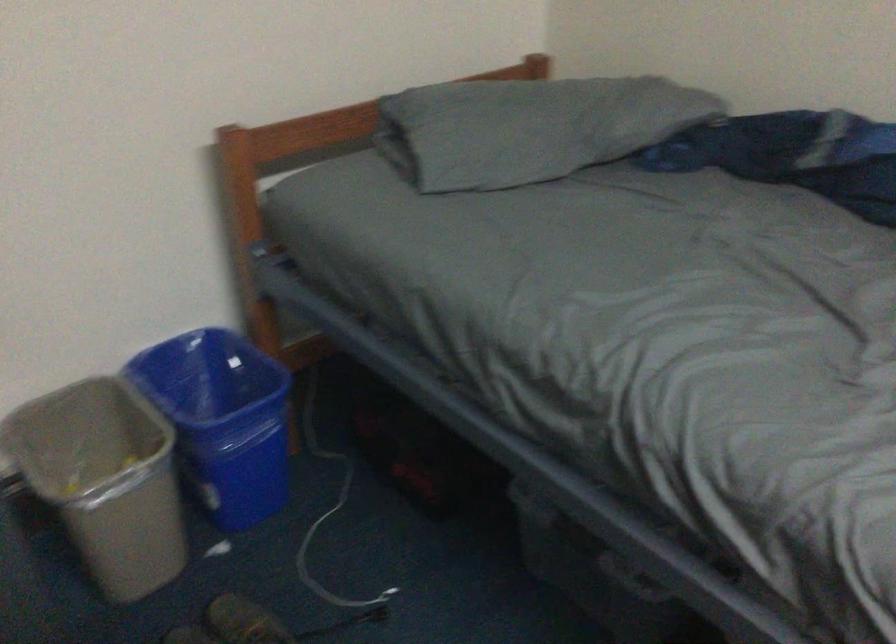
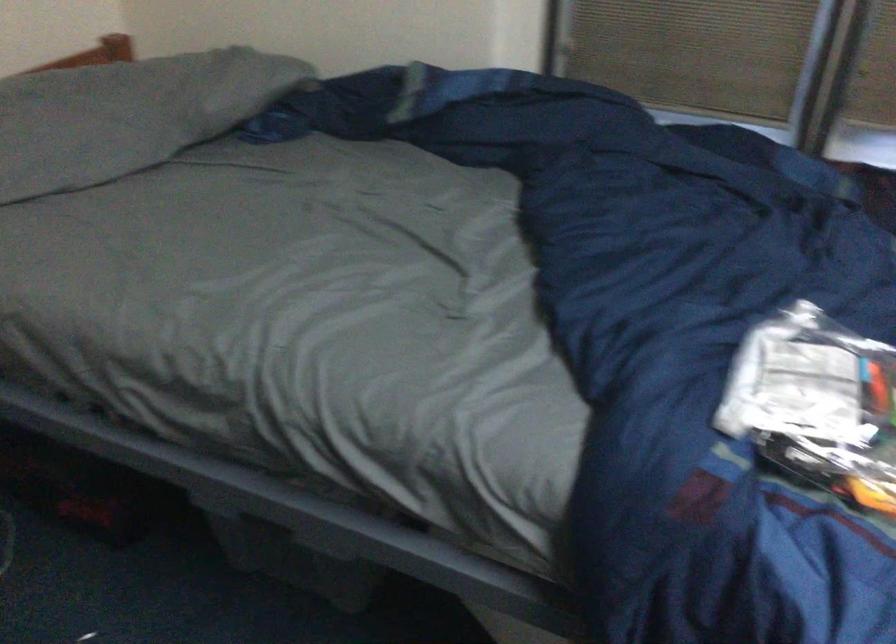
Question: The images are taken continuously from a first-person perspective. In which direction are you moving?

Choices:
 (A) Left
 (B) Right
 (C) Forward
 (D) Backward

Answer: (B)